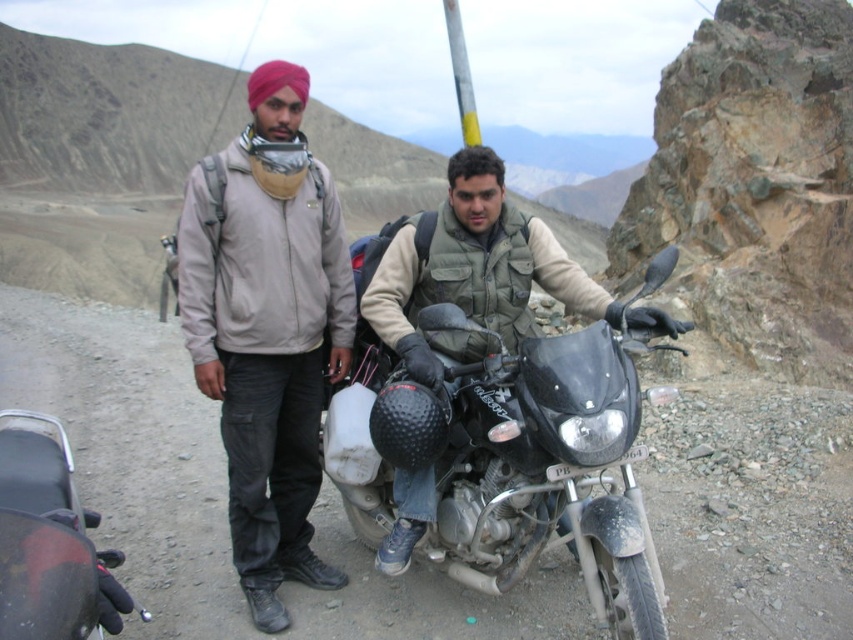
Question: Can you confirm if matte khaki jacket at center is smaller than matte black helmet at center?

Choices:
 (A) yes
 (B) no

Answer: (A)

Question: Is matte black helmet at center further to the viewer compared to beige fabric headscarf at center?

Choices:
 (A) yes
 (B) no

Answer: (B)

Question: Which object is farther from the camera taking this photo?

Choices:
 (A) matte black helmet at center
 (B) matte khaki jacket at center
 (C) beige fabric headscarf at center

Answer: (C)

Question: Which is nearer to the matte khaki jacket at center?

Choices:
 (A) matte black helmet at center
 (B) beige fabric headscarf at center

Answer: (B)

Question: Is matte khaki jacket at center to the right of beige fabric headscarf at center from the viewer's perspective?

Choices:
 (A) no
 (B) yes

Answer: (A)

Question: Which object is farther from the camera taking this photo?

Choices:
 (A) matte black helmet at center
 (B) beige fabric headscarf at center

Answer: (B)